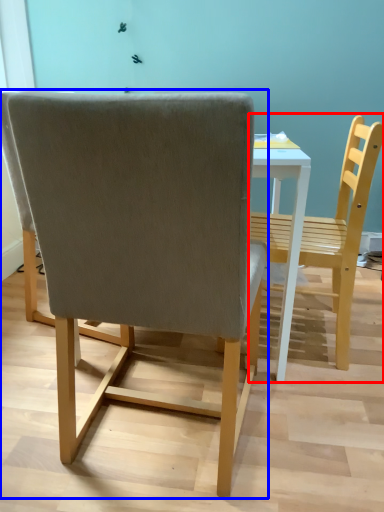
Question: Which object appears closest to the camera in this image, chair (highlighted by a red box) or chair (highlighted by a blue box)?

Choices:
 (A) chair
 (B) chair

Answer: (B)